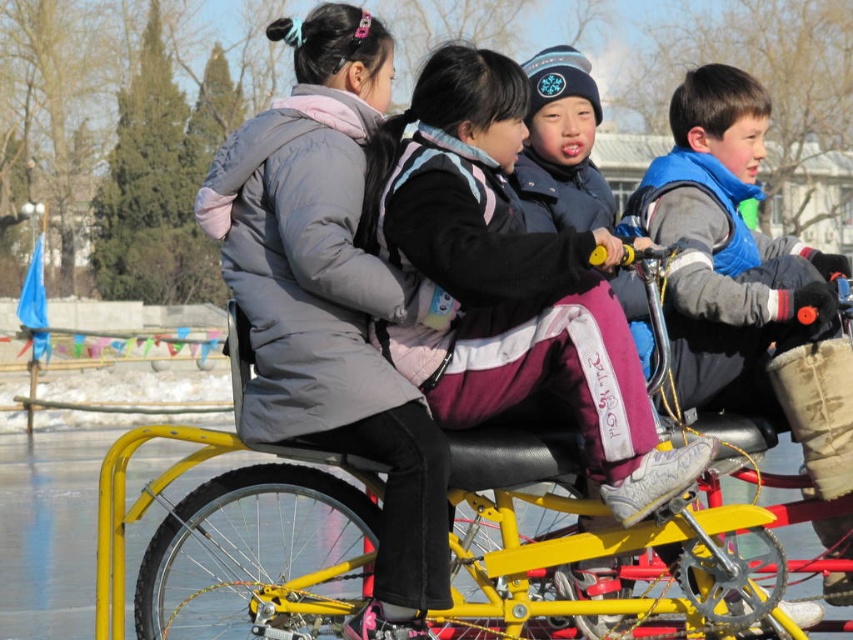
You are a photographer trying to capture the children on the multi seated bicycle. You notice the blue fleece vest at right and the matte black jacket at center. Which clothing item would appear larger in your photo?

The blue fleece vest at right would appear larger in the photo because it is bigger than the matte black jacket at center.

You are a photographer standing at the edge of the ice rink. You want to take a photo of the gray down jacket at center and the purple fleece jacket at center so that both are in focus. The camera you are using has a depth of field that can cover 2 meters. Will both jackets be in focus in the photo?

The distance between the gray down jacket at center and the purple fleece jacket at center is 2.16 meters. Since the camera can only cover 2 meters, the jackets are slightly out of the depth of field range, so they might not both be in focus.

You are standing at the center of the ice rink and see the point marked as point (744, 276). What object is located at that point?

The point (744, 276) is where the blue fleece vest at right is located.